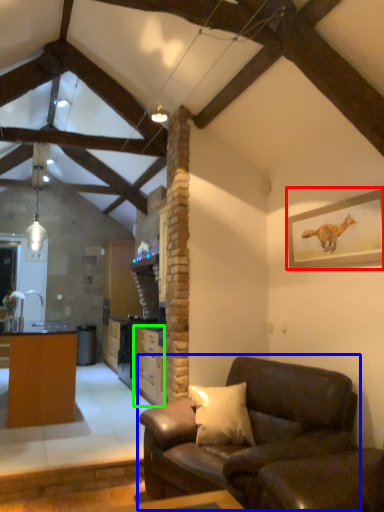
Question: Estimate the real-world distances between objects in this image. Which object is closer to picture frame (highlighted by a red box), studio couch (highlighted by a blue box) or cabinetry (highlighted by a green box)?

Choices:
 (A) studio couch
 (B) cabinetry

Answer: (A)